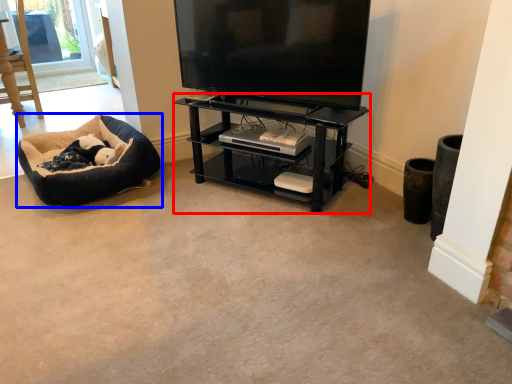
Question: Among these objects, which one is farthest to the camera, shelf (highlighted by a red box) or dog bed (highlighted by a blue box)?

Choices:
 (A) shelf
 (B) dog bed

Answer: (B)